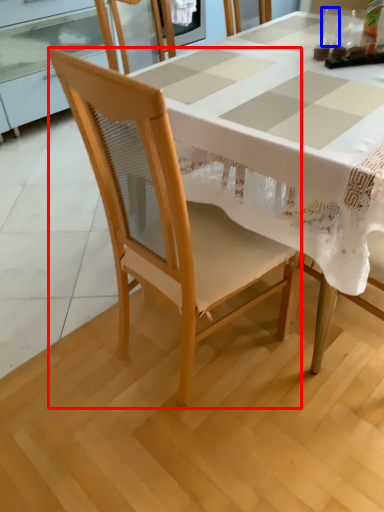
Question: Which object appears farthest to the camera in this image, chair (highlighted by a red box) or tableware (highlighted by a blue box)?

Choices:
 (A) chair
 (B) tableware

Answer: (B)